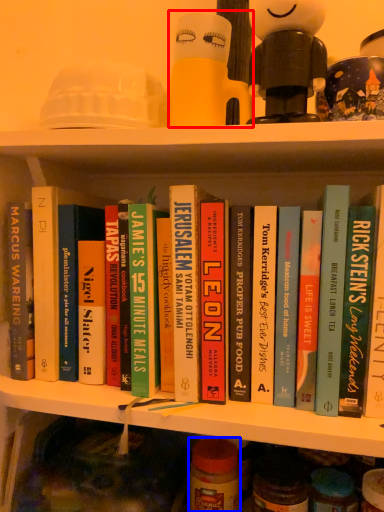
Question: Which point is closer to the camera, toy (highlighted by a red box) or glass jar (highlighted by a blue box)?

Choices:
 (A) toy
 (B) glass jar

Answer: (A)